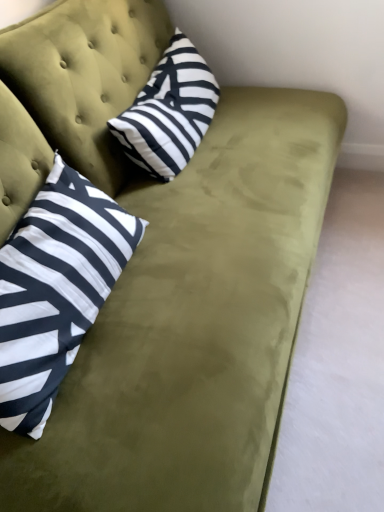
Question: From a real-world perspective, relative to white and black striped pillow at left, which ranks as the first pillow in bottom-to-top order, is black and white striped pillow at upper center, the second pillow in the bottom-to-top sequence, vertically above or below?

Choices:
 (A) above
 (B) below

Answer: (B)

Question: In the image, is black and white striped pillow at upper center, the second pillow in the bottom-to-top sequence, on the left side or the right side of white and black striped pillow at left, the 2th pillow positioned from the top?

Choices:
 (A) left
 (B) right

Answer: (B)

Question: Is black and white striped pillow at upper center, the second pillow in the bottom-to-top sequence, taller or shorter than white and black striped pillow at left, the 2th pillow positioned from the top?

Choices:
 (A) short
 (B) tall

Answer: (A)

Question: In the image, is white and black striped pillow at left, the 2th pillow positioned from the top, positioned in front of or behind black and white striped pillow at upper center, the second pillow in the bottom-to-top sequence?

Choices:
 (A) front
 (B) behind

Answer: (A)

Question: From a real-world perspective, relative to black and white striped pillow at upper center, the first pillow in the top-to-bottom sequence, is white and black striped pillow at left, which ranks as the first pillow in bottom-to-top order, vertically above or below?

Choices:
 (A) below
 (B) above

Answer: (B)

Question: Looking at the image, does white and black striped pillow at left, which ranks as the first pillow in bottom-to-top order, seem bigger or smaller compared to black and white striped pillow at upper center, the first pillow in the top-to-bottom sequence?

Choices:
 (A) big
 (B) small

Answer: (A)

Question: Is white and black striped pillow at left, the 2th pillow positioned from the top, taller or shorter than black and white striped pillow at upper center, the second pillow in the bottom-to-top sequence?

Choices:
 (A) short
 (B) tall

Answer: (B)